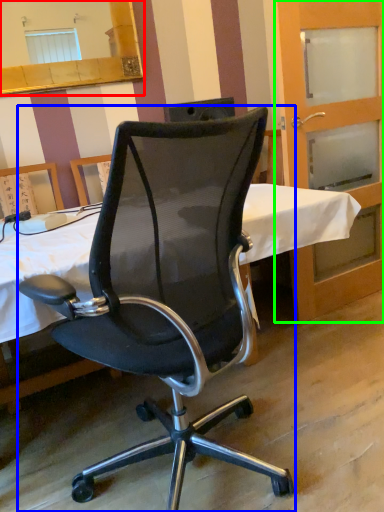
Question: Which object is positioned farthest from mirror (highlighted by a red box)? Select from chair (highlighted by a blue box) and screen door (highlighted by a green box).

Choices:
 (A) chair
 (B) screen door

Answer: (A)